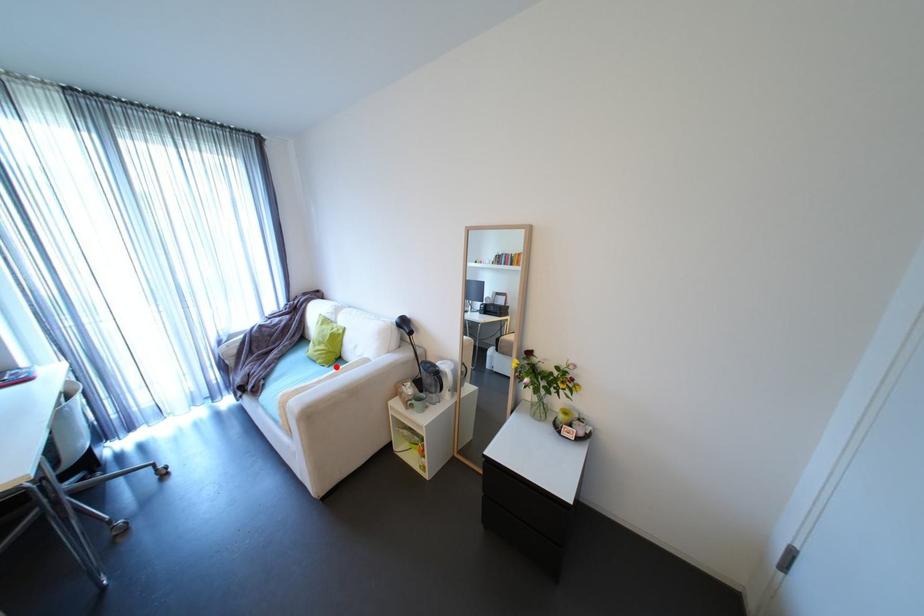
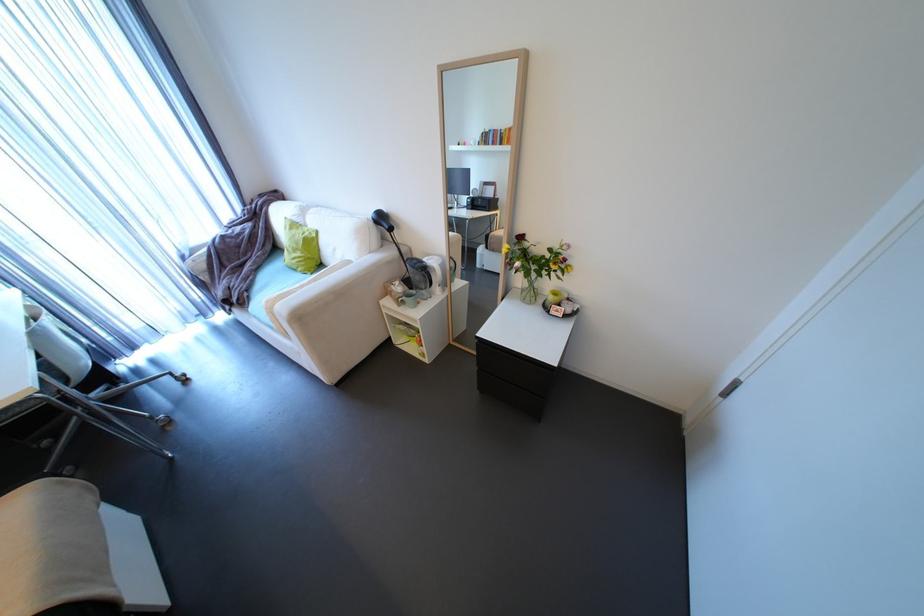
Where in the second image is the point corresponding to the highlighted location from the first image?

(319, 274)